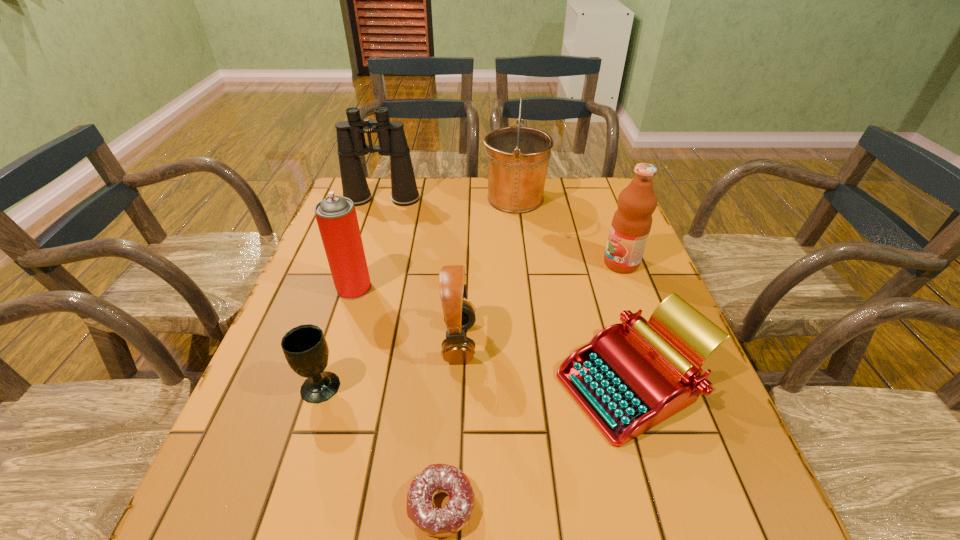
I want to click on binoculars located in the left edge section of the desktop, so click(351, 142).

The width and height of the screenshot is (960, 540). Find the location of `aerosol can that is at the left edge`. aerosol can that is at the left edge is located at coordinates (336, 216).

Locate an element on the screen. chalice situated at the left edge is located at coordinates (305, 348).

Locate an element on the screen. The width and height of the screenshot is (960, 540). fruit juice positioned at the right edge is located at coordinates (631, 224).

You are a GUI agent. You are given a task and a screenshot of the screen. Output one action in this format:
    pyautogui.click(x=<x>, y=<y>)
    Task: Click on the typewriter at the right edge
    
    Given the screenshot: What is the action you would take?
    pyautogui.click(x=631, y=376)

Locate an element on the screen. Image resolution: width=960 pixels, height=540 pixels. object located at the far left corner is located at coordinates (351, 142).

Find the location of a particular element. This screenshot has width=960, height=540. vacant point at the far edge is located at coordinates (550, 194).

The image size is (960, 540). In the image, there is a desktop. In order to click on free space at the left edge in this screenshot , I will do `click(325, 335)`.

This screenshot has height=540, width=960. In the image, there is a desktop. Find the location of `vacant space at the right edge`. vacant space at the right edge is located at coordinates (659, 436).

You are a GUI agent. You are given a task and a screenshot of the screen. Output one action in this format:
    pyautogui.click(x=<x>, y=<y>)
    Task: Click on the vacant space at the far left corner of the desktop
    
    Given the screenshot: What is the action you would take?
    pyautogui.click(x=374, y=178)